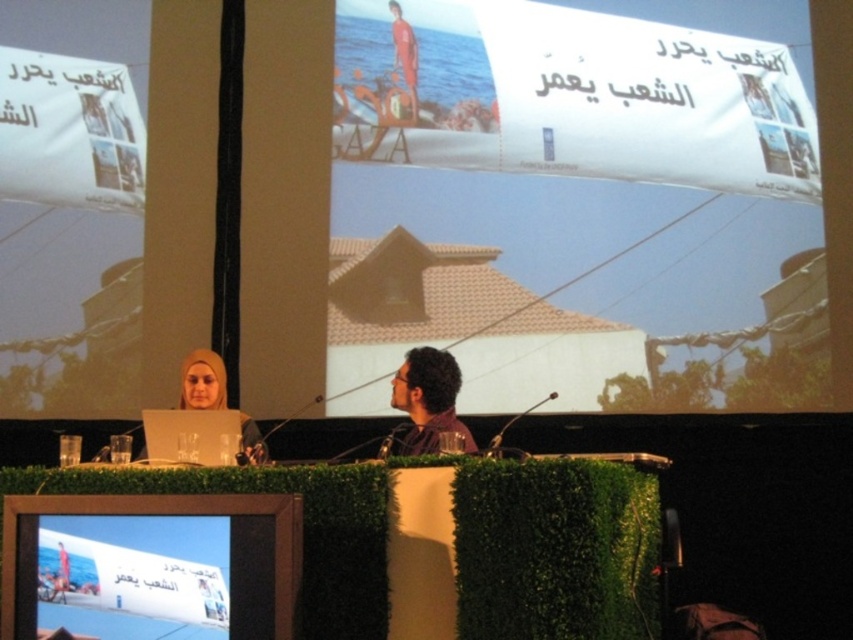
You are a photographer positioned behind the large screen. You want to take a photo that captures both the brown fabric shirt at center and the orange life vest at upper center. Which object should you adjust your focus to first to ensure both are in frame?

The brown fabric shirt at center is closer to the viewer than the orange life vest at upper center, so you should focus on the brown fabric shirt at center first to ensure both are in frame.

You are organizing a presentation and need to place a matte beige hijab at center and a white paper at upper center on a table. Based on the image, which object should you place first to ensure proper alignment?

The white paper at upper center might be wider than matte beige hijab at center, so you should place the white paper at upper center first to accommodate its width and ensure proper alignment.